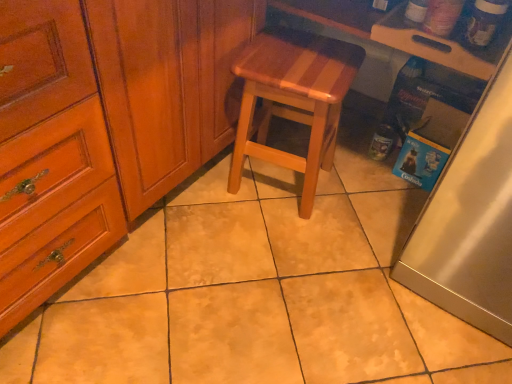
The height and width of the screenshot is (384, 512). What are the coordinates of `vacant point to the right of natural wood stool at center` in the screenshot? It's located at (360, 194).